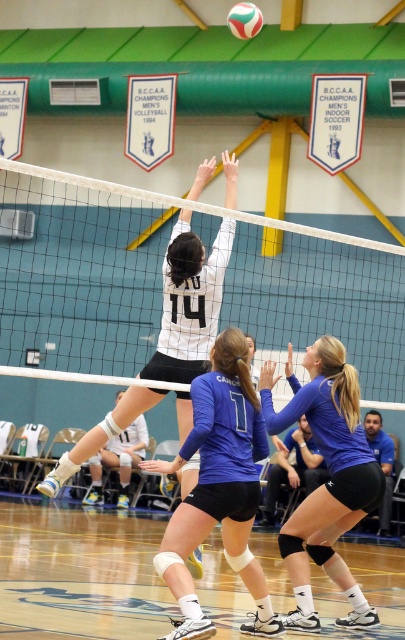
Does blue jersey at center come in front of white matte volleyball net at center?

Yes, blue jersey at center is closer to the viewer.

Is blue jersey at center thinner than white matte volleyball net at center?

Incorrect, blue jersey at center's width is not less than white matte volleyball net at center's.

Measure the distance between point (176, 460) and camera.

A distance of 24.08 feet exists between point (176, 460) and camera.

The height and width of the screenshot is (640, 405). Find the location of `blue jersey at center`. blue jersey at center is located at coordinates (219, 486).

Is black synthetic volleyball at center to the right of blue jersey at center from the viewer's perspective?

Yes, black synthetic volleyball at center is to the right of blue jersey at center.

Who is positioned more to the right, black synthetic volleyball at center or blue jersey at center?

From the viewer's perspective, black synthetic volleyball at center appears more on the right side.

What do you see at coordinates (80, 573) in the screenshot? Image resolution: width=405 pixels, height=640 pixels. I see `black synthetic volleyball at center` at bounding box center [80, 573].

Locate an element on the screen. This screenshot has height=640, width=405. black synthetic volleyball at center is located at coordinates (80, 573).

Can you confirm if blue jersey at center is positioned below blue matte volleyball player at center?

Actually, blue jersey at center is above blue matte volleyball player at center.

Can you confirm if blue jersey at center is wider than blue matte volleyball player at center?

Correct, the width of blue jersey at center exceeds that of blue matte volleyball player at center.

Which is behind, point (249, 417) or point (319, 529)?

The point (319, 529) is behind.

Find the location of a particular element. The width and height of the screenshot is (405, 640). blue jersey at center is located at coordinates (219, 486).